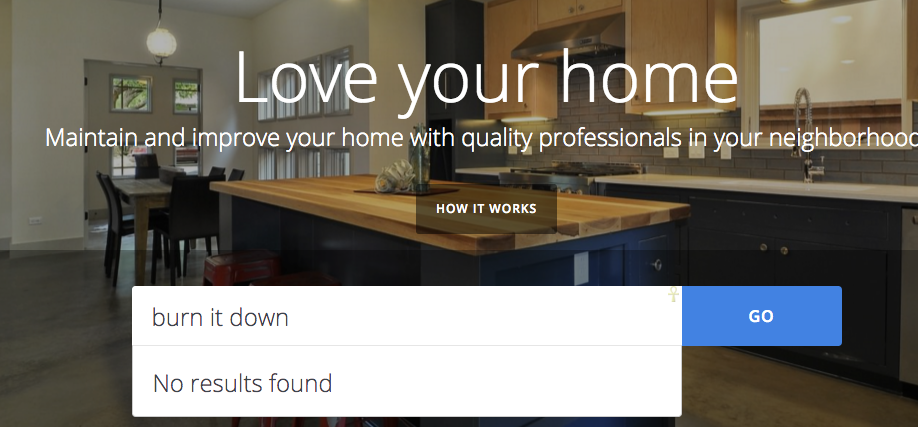
Where is `kitchen chairs`? The width and height of the screenshot is (918, 427). kitchen chairs is located at coordinates (110, 199), (144, 165), (215, 174), (237, 176).